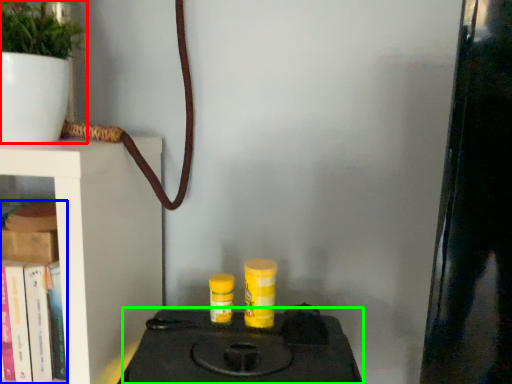
Question: Which object is positioned closest to houseplant (highlighted by a red box)? Select from book (highlighted by a blue box) and stove (highlighted by a green box).

Choices:
 (A) book
 (B) stove

Answer: (A)